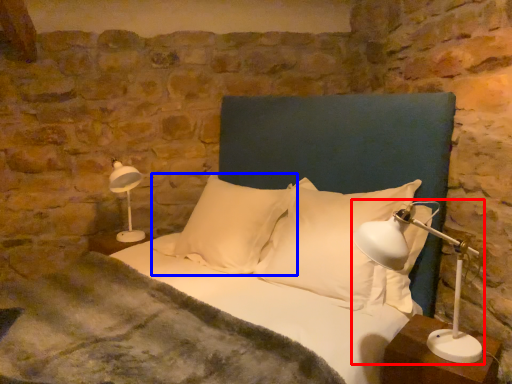
Question: Which object is further to the camera taking this photo, table lamp (highlighted by a red box) or pillow (highlighted by a blue box)?

Choices:
 (A) table lamp
 (B) pillow

Answer: (B)